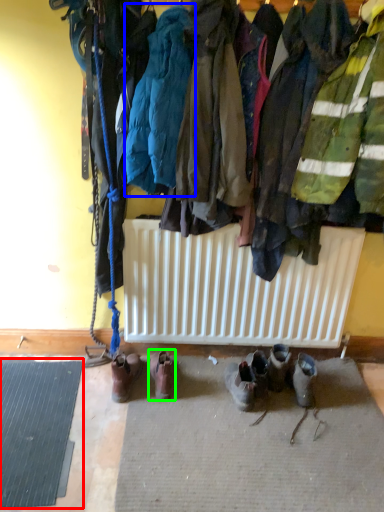
Question: Which is nearer to the doormat (highlighted by a red box)? jacket (highlighted by a blue box) or footwear (highlighted by a green box).

Choices:
 (A) jacket
 (B) footwear

Answer: (B)